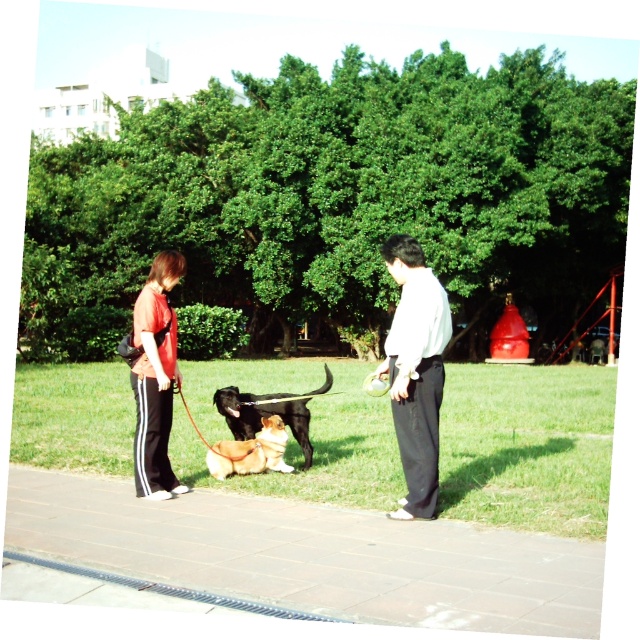
You are standing at the origin point in the park. There is a light blue shirt at center located at point (416, 371). Can you walk straight from your current position to reach the light blue shirt at center without crossing any obstacles?

Yes, since the light blue shirt at center is located at point (416, 371), which is directly in front of you along the straight path, there are no obstacles mentioned in the scene description to block your way.

You are standing at the edge of the gray concrete pavement at lower center. If you walk straight ahead, will you step onto the grassy area or stay on the pavement?

Since the gray concrete pavement at lower center is positioned at point (x=316, y=554), walking straight ahead from there would lead you onto the grassy area as the pavement ends beyond that point.